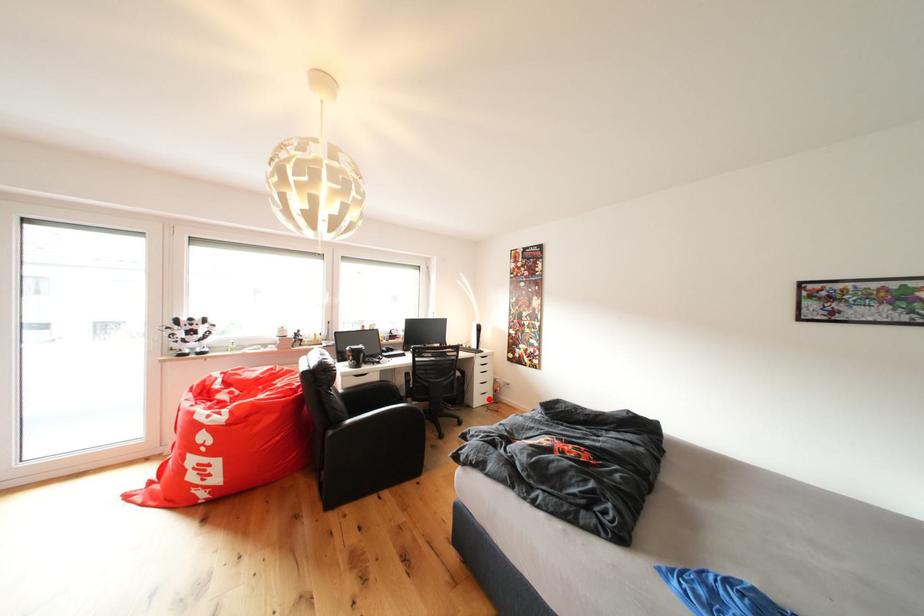
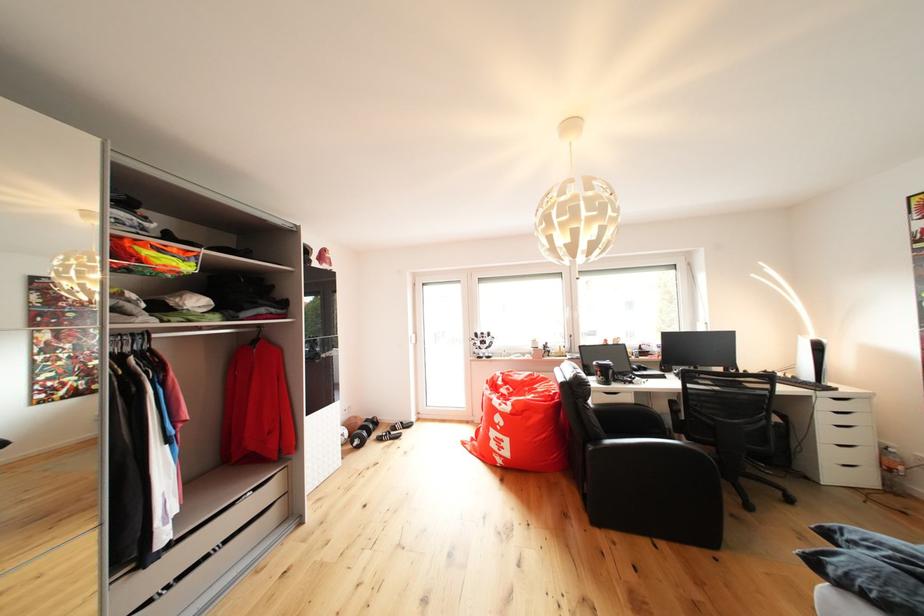
In the second image, find the point that corresponds to the highlighted location in the first image.

(846, 469)